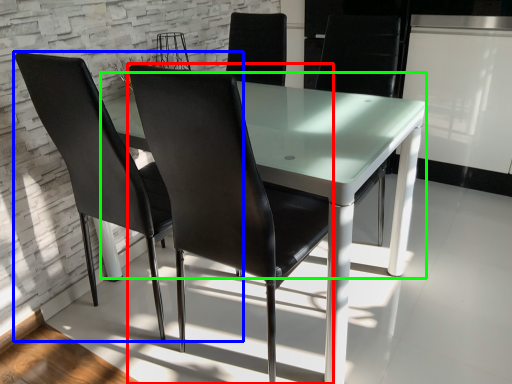
Question: Estimate the real-world distances between objects in this image. Which object is closer to chair (highlighted by a red box), chair (highlighted by a blue box) or round table (highlighted by a green box)?

Choices:
 (A) chair
 (B) round table

Answer: (B)